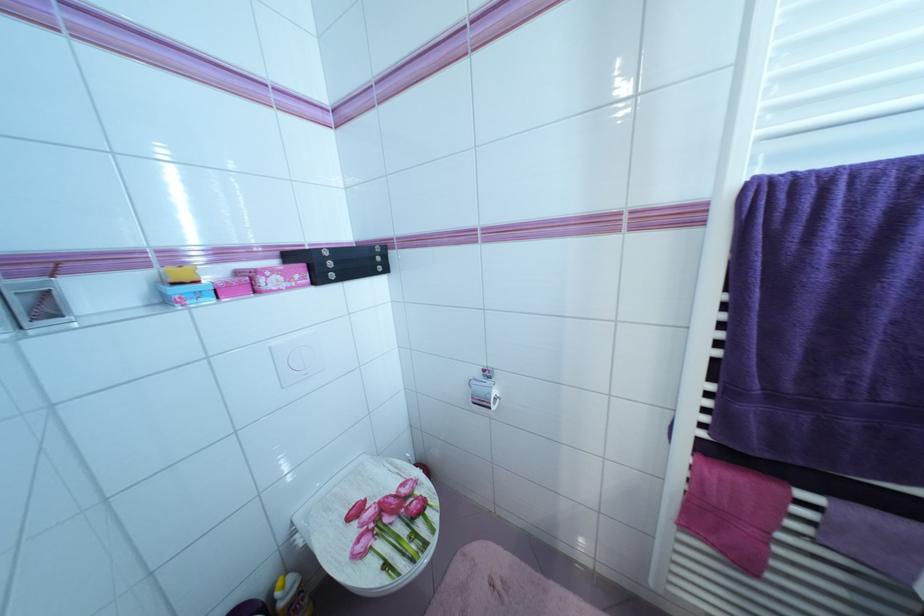
You are a GUI agent. You are given a task and a screenshot of the screen. Output one action in this format:
    pyautogui.click(x=<x>, y=<y>)
    Task: Click on the pink floral box
    This screenshot has width=924, height=616.
    Given the screenshot: What is the action you would take?
    (275, 277)